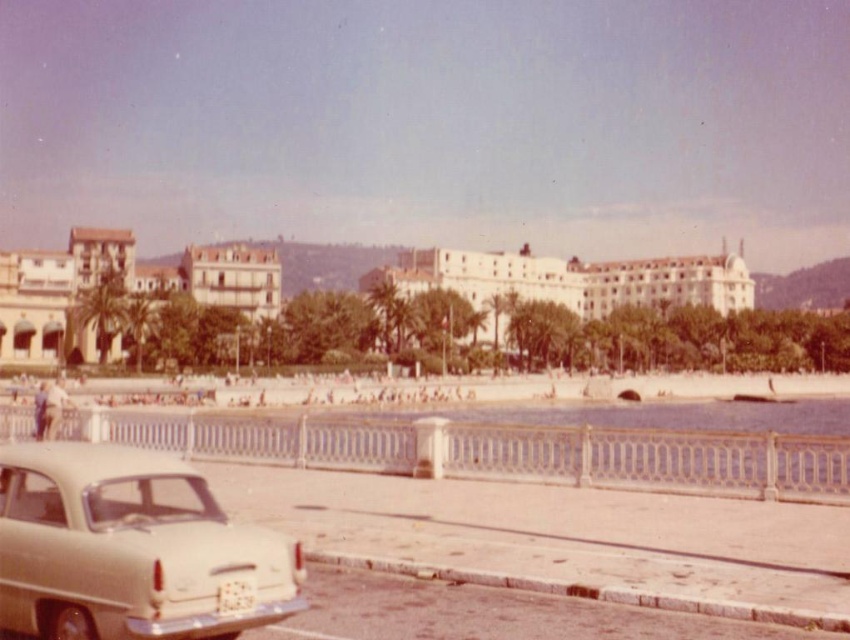
Question: Which point is farther to the camera?

Choices:
 (A) (55, 314)
 (B) (196, 547)
 (C) (497, 257)

Answer: (C)

Question: Is beige matte car at lower left above white textured building at center?

Choices:
 (A) yes
 (B) no

Answer: (B)

Question: In this image, where is beige matte car at lower left located relative to white textured building at center?

Choices:
 (A) above
 (B) below

Answer: (B)

Question: Among these objects, which one is nearest to the camera?

Choices:
 (A) beige matte car at lower left
 (B) beige stucco building at left
 (C) white textured building at center

Answer: (A)

Question: Is the position of beige matte car at lower left more distant than that of beige stucco building at left?

Choices:
 (A) yes
 (B) no

Answer: (B)

Question: Considering the real-world distances, which object is closest to the white textured building at center?

Choices:
 (A) beige stucco building at left
 (B) beige matte car at lower left

Answer: (A)